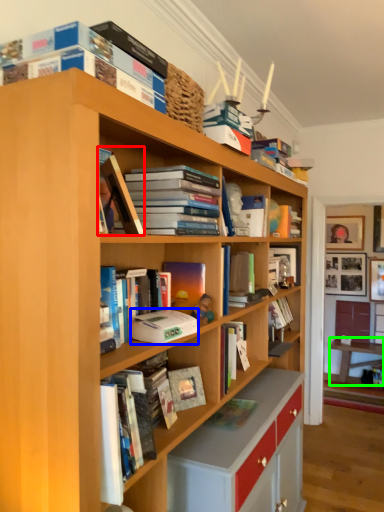
Question: Which is farther away from book (highlighted by a red box)? paperback book (highlighted by a blue box) or table (highlighted by a green box)?

Choices:
 (A) paperback book
 (B) table

Answer: (B)